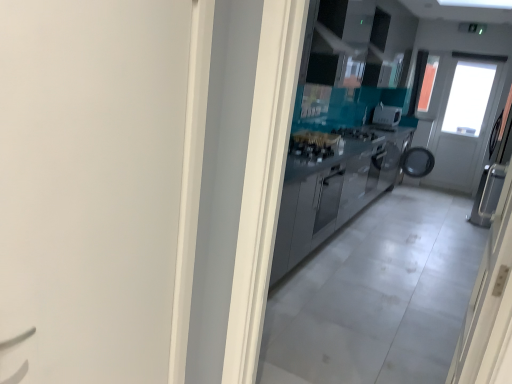
Identify the location of vacant location behind satin silver door at right, acting as the second door starting from the left. (376, 342).